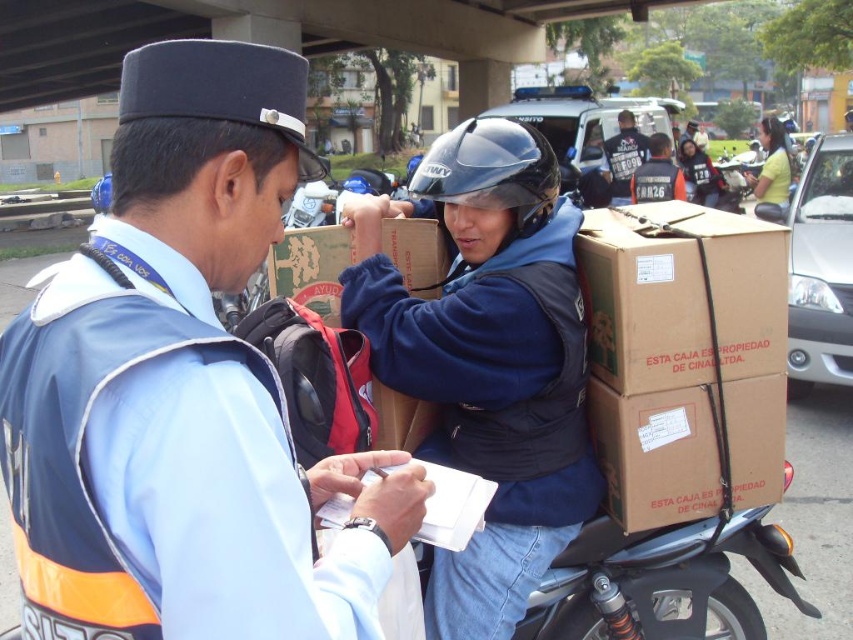
You are standing at the point labeled point [525,186]. The traffic officer is on the left side of the frame. Can you see the traffic officer from your current position?

Yes, because the point [525,186] is 1.94 meters away from the viewer, so you can see the traffic officer on the left side of the frame from that position.

You are a pedestrian standing at the crosswalk and see both the blue matte helmet at upper center and the matte black helmet at upper center. Which helmet is taller?

The blue matte helmet at upper center is taller than the matte black helmet at upper center.

You are a delivery driver who needs to pick up a package from the traffic officer. The officer is holding a document at point A. Your motorcycle is parked at point B. To reach the officer, you must move from point B to point A. Which direction should you move relative to the black matte helmet at center?

The black matte helmet at center is located at point (491, 172). Since the officer is on the left and you are on the right, you should move to the left to reach the officer.